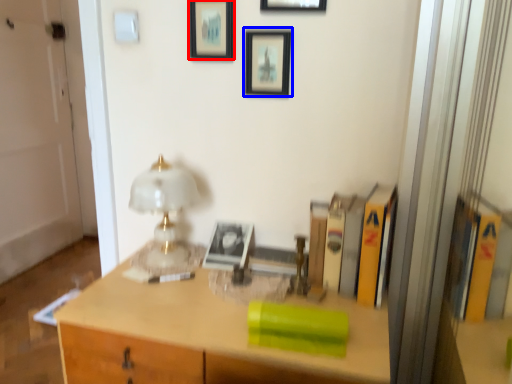
Question: Which of the following is the closest to the observer, picture frame (highlighted by a red box) or picture frame (highlighted by a blue box)?

Choices:
 (A) picture frame
 (B) picture frame

Answer: (B)